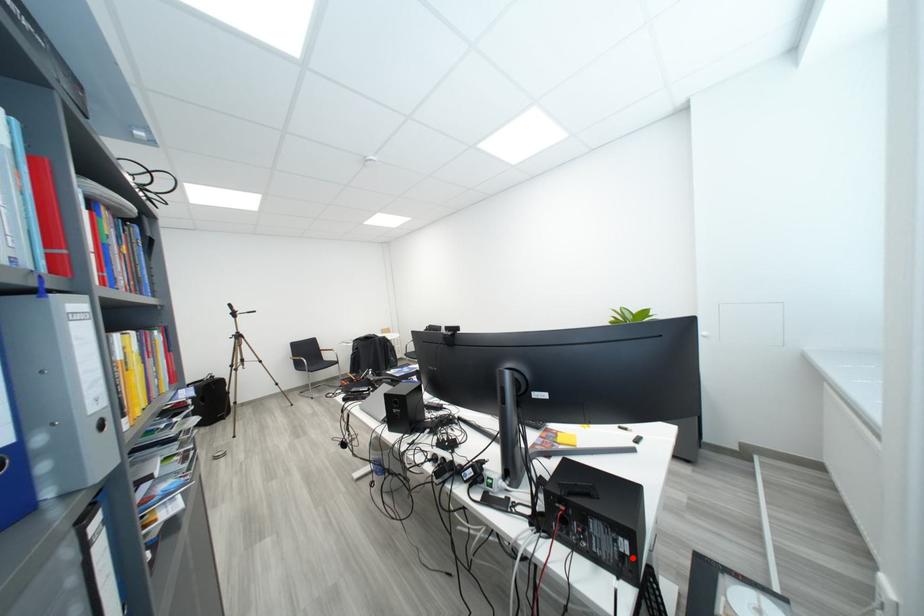
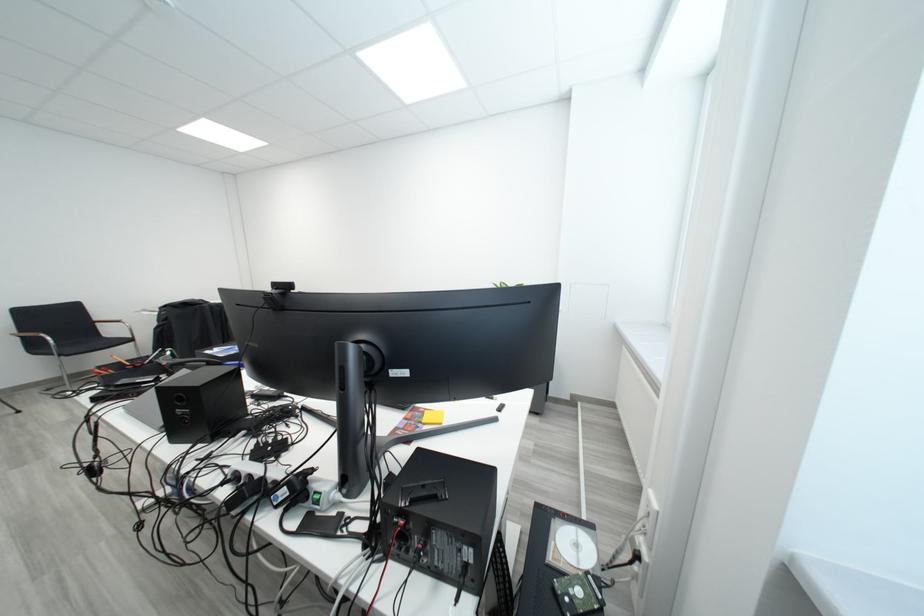
Locate, in the second image, the point that corresponds to the highlighted location in the first image.

(476, 569)